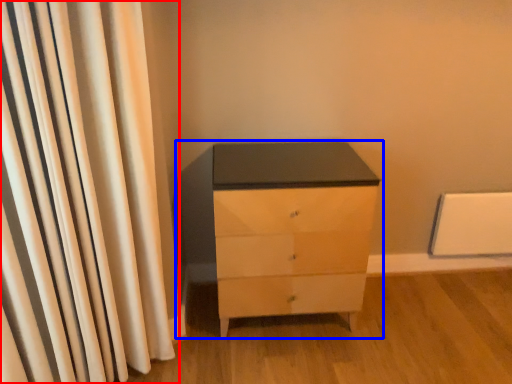
Question: Which point is further to the camera, curtain (highlighted by a red box) or chest of drawers (highlighted by a blue box)?

Choices:
 (A) curtain
 (B) chest of drawers

Answer: (B)